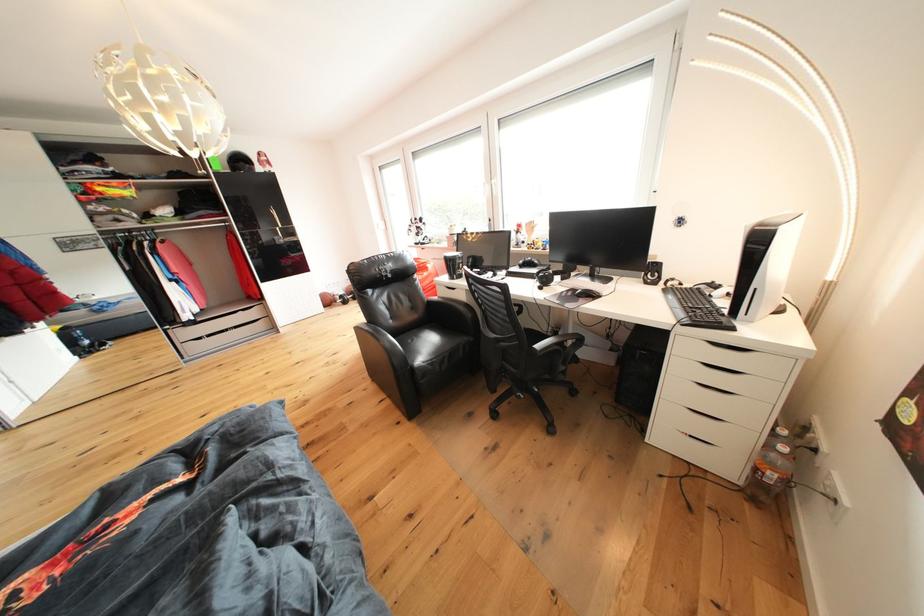
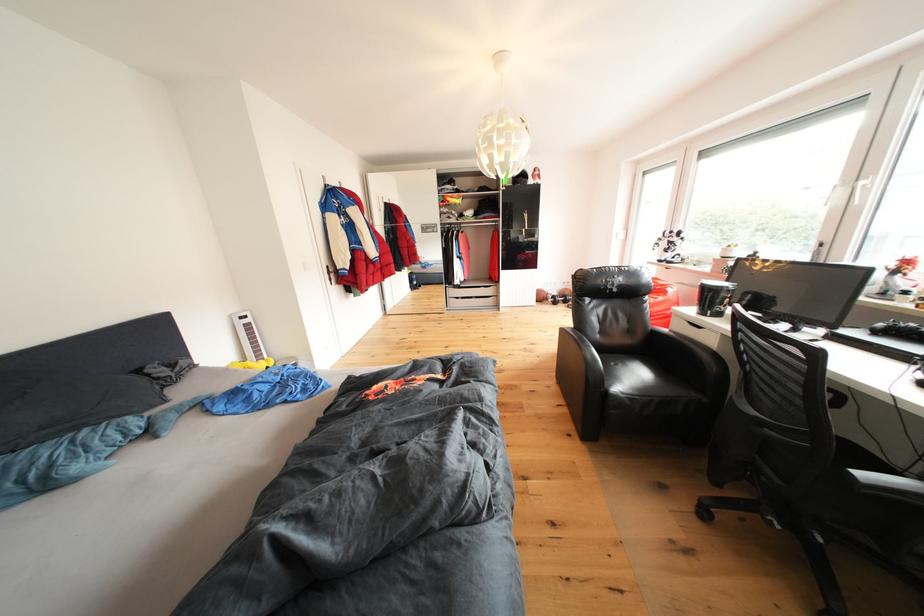
Find the pixel in the second image that matches (421,345) in the first image.

(625, 370)